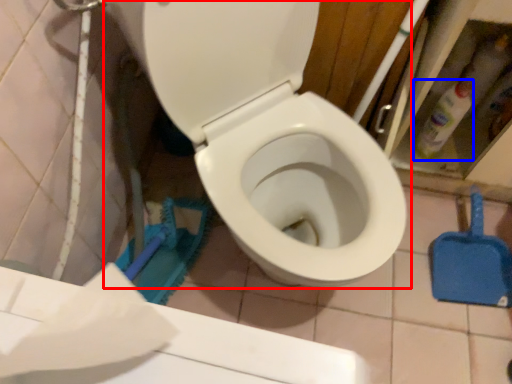
Question: Which object appears closest to the camera in this image, toilet (highlighted by a red box) or cleaning product (highlighted by a blue box)?

Choices:
 (A) toilet
 (B) cleaning product

Answer: (A)